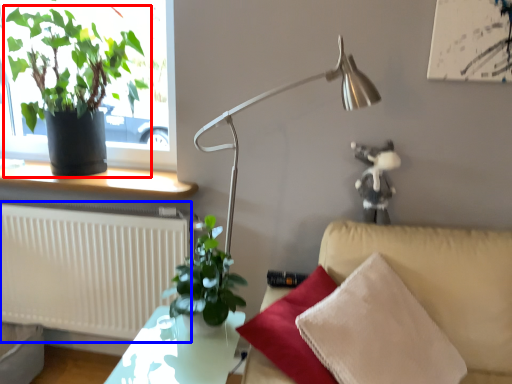
Question: Which of the following is the farthest to the observer, houseplant (highlighted by a red box) or radiator (highlighted by a blue box)?

Choices:
 (A) houseplant
 (B) radiator

Answer: (B)